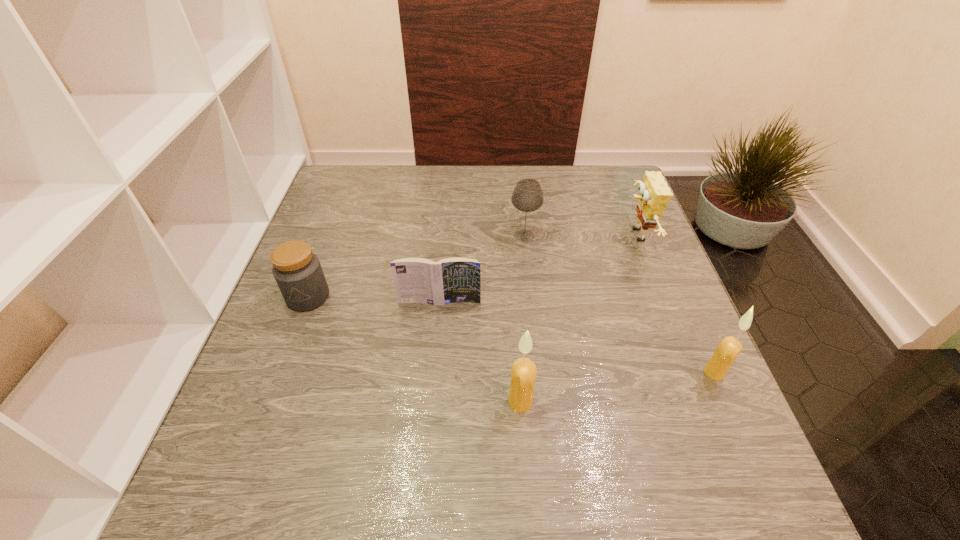
Locate an element on the screen. sponge situated at the right edge is located at coordinates pyautogui.click(x=654, y=195).

Locate an element on the screen. object positioned at the far right corner is located at coordinates (654, 195).

The height and width of the screenshot is (540, 960). I want to click on vacant region at the far edge, so coord(468,178).

Where is `vacant space at the near edge`? vacant space at the near edge is located at coordinates (478, 406).

I want to click on free space at the left edge, so click(x=338, y=264).

At what (x,y) coordinates should I click in order to perform the action: click on vacant space at the right edge. Please return your answer as a coordinate pair (x, y). This screenshot has width=960, height=540. Looking at the image, I should click on (656, 345).

Where is `free space at the far right corner of the desktop`? The height and width of the screenshot is (540, 960). free space at the far right corner of the desktop is located at coordinates (634, 211).

Identify the location of vacant area at the near right corner of the desktop. The height and width of the screenshot is (540, 960). (672, 427).

Identify the location of free spot between the sponge and the farther candle. pyautogui.click(x=675, y=304).

At what (x,y) coordinates should I click in order to perform the action: click on free spot between the sponge and the right candle. Please return your answer as a coordinate pair (x, y). Looking at the image, I should click on (675, 304).